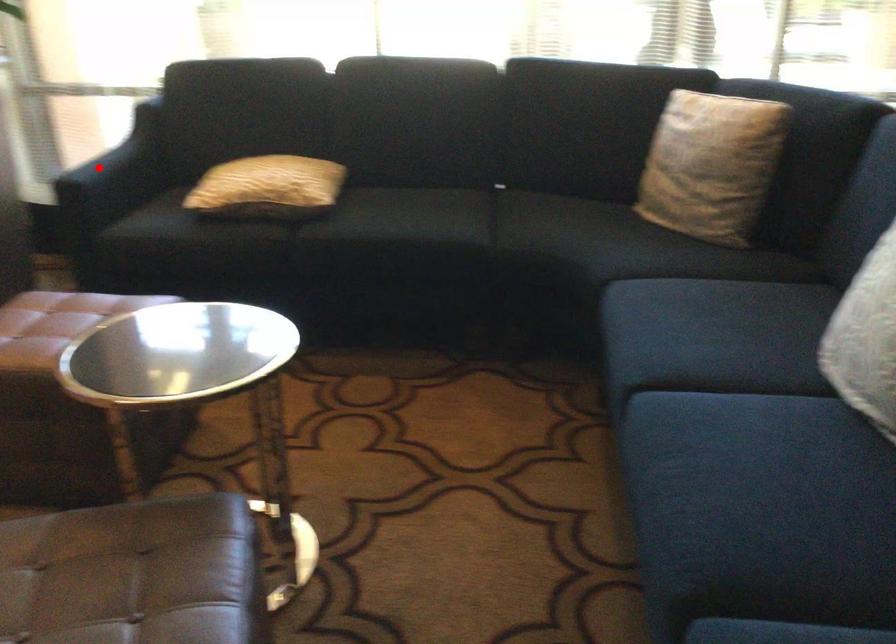
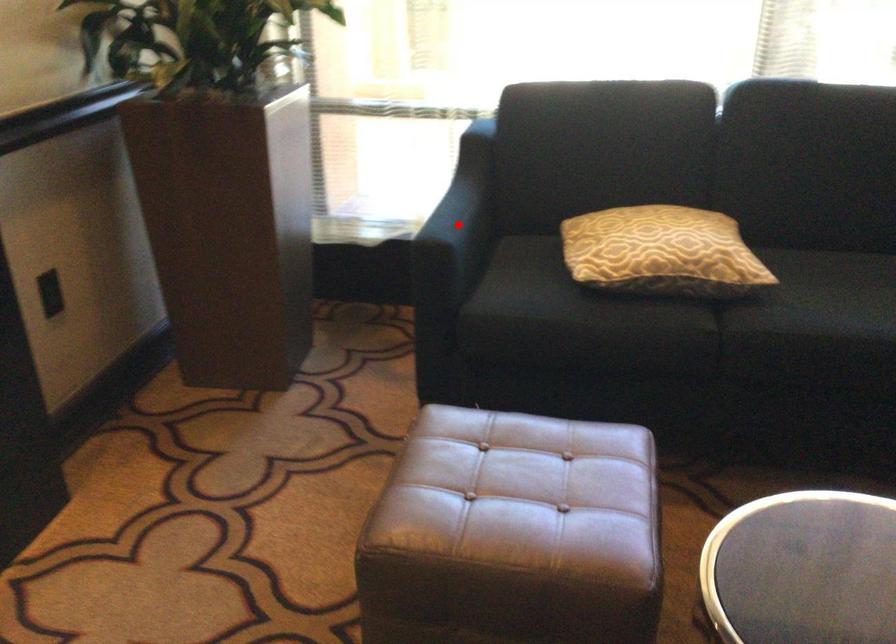
I am providing you with two images of the same scene from different viewpoints. A red point is marked on the first image and another point is marked on the second image. Are the points marked in image1 and image2 representing the same 3D position?

Yes